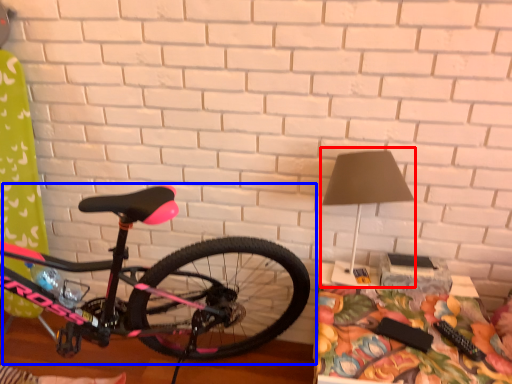
Question: Among these objects, which one is farthest to the camera, table lamp (highlighted by a red box) or bicycle (highlighted by a blue box)?

Choices:
 (A) table lamp
 (B) bicycle

Answer: (A)